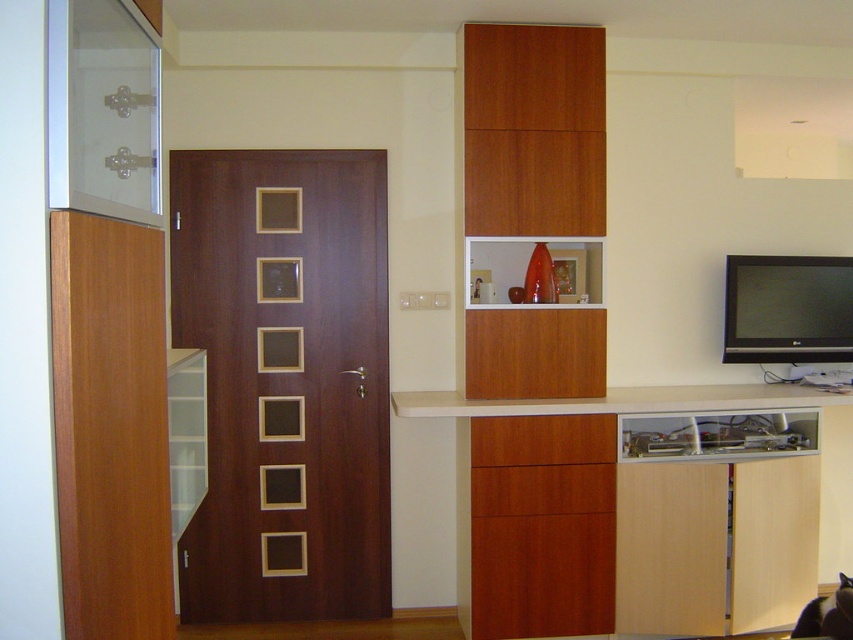
You are standing in the living room and looking at the wooden door with six square cutouts. There are two points marked on the door at coordinates point [550,445] and point [550,492]. If you want to touch both points starting from the one closer to you, which point should you touch first?

You should touch point [550,445] first because it is closer to you than point [550,492], as it is further to the camera.

You are a furniture delivery person and need to place a new sofa that is 1.8 meters wide in this room. The sofa must be placed between the black glossy tv at right and the wooden cabinet at lower center. Is there enough space between them to fit the sofa?

The black glossy tv at right has a larger size compared to wooden cabinet at lower center. However, the question is about the space between them, not their sizes. Since the description only mentions their sizes relative to each other, there is no information provided about the distance between them. Therefore, it is impossible to determine if the sofa will fit based on the given details.

You are organizing the living room and need to place a rectangular box that is 1.2 meters long. You see the wooden cabinet at lower center and the wooden drawer at lower center. Which one can accommodate the box based on their widths?

The wooden cabinet at lower center has a larger width than the wooden drawer at lower center, so the box can fit in the wooden cabinet at lower center if its length is within the cabinet width. However, the exact width isn mentioned, so we cannot confirm. Wait, the Objects Description says the cabinet is wider. Since the box is 1.2 meters long, if the cabinet is wider than 1.2 meters, it can fit. But since the exact width isn provided, the answer should state the cabinet is wider, so it has a better chance.